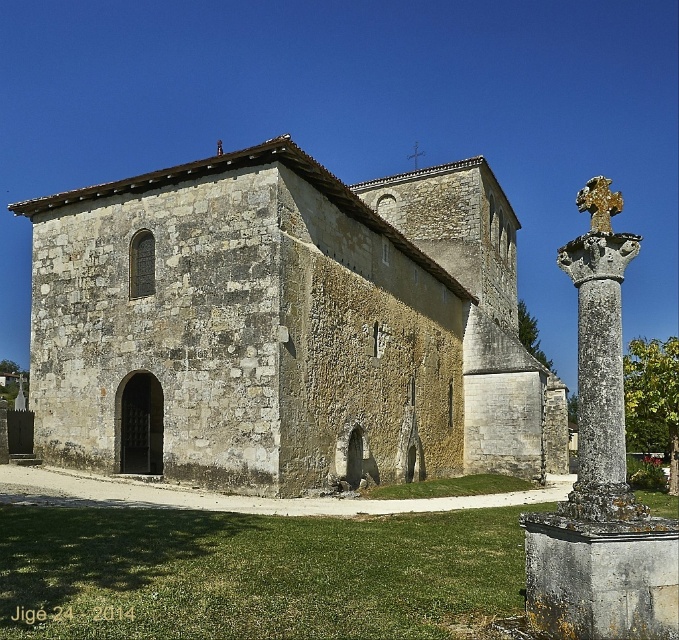
Question: Can you confirm if stone church at center is smaller than gold textured cross at right?

Choices:
 (A) yes
 (B) no

Answer: (A)

Question: Which object is farther from the camera taking this photo?

Choices:
 (A) stone cross at right
 (B) gold textured cross at right
 (C) stone church at center

Answer: (C)

Question: Is stone church at center positioned at the back of gold textured cross at right?

Choices:
 (A) yes
 (B) no

Answer: (A)

Question: Estimate the real-world distances between objects in this image. Which object is farther from the gold textured cross at right?

Choices:
 (A) stone cross at right
 (B) stone church at center

Answer: (B)

Question: Observing the image, what is the correct spatial positioning of stone church at center in reference to stone cross at right?

Choices:
 (A) right
 (B) left

Answer: (B)

Question: Which point is farther to the camera?

Choices:
 (A) (185, 186)
 (B) (585, 538)

Answer: (A)